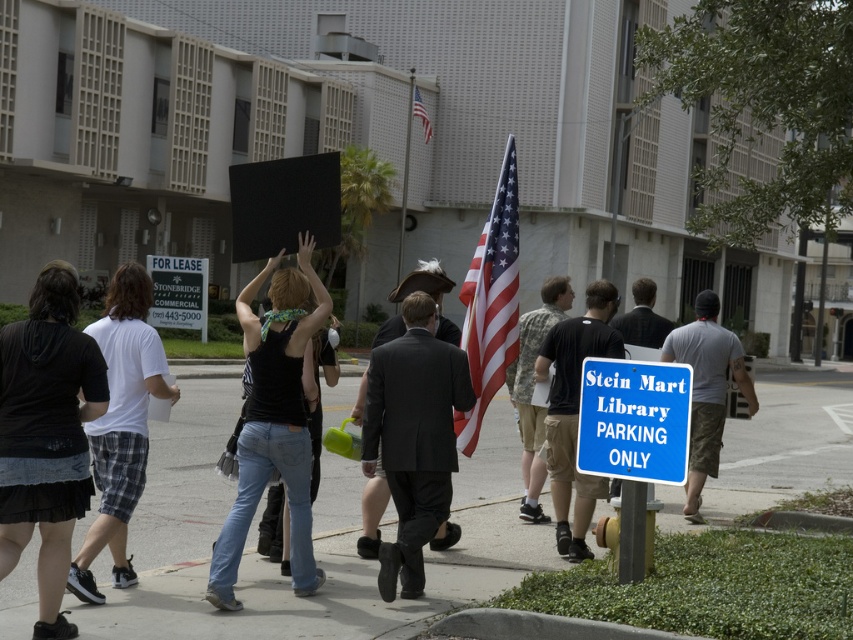
Who is higher up, dark gray suit at center or blue plastic sign at lower right?

blue plastic sign at lower right is above.

Does dark gray suit at center have a greater height compared to blue plastic sign at lower right?

Correct, dark gray suit at center is much taller as blue plastic sign at lower right.

Who is more distant from viewer, (389, 556) or (582, 380)?

The point (389, 556) is behind.

Find the location of a particular element. The width and height of the screenshot is (853, 640). dark gray suit at center is located at coordinates (413, 436).

Is white plaid shorts at left bigger than blue plastic sign at lower right?

Indeed, white plaid shorts at left has a larger size compared to blue plastic sign at lower right.

Consider the image. Can you confirm if white plaid shorts at left is positioned below blue plastic sign at lower right?

Indeed, white plaid shorts at left is positioned under blue plastic sign at lower right.

What do you see at coordinates (120, 424) in the screenshot? I see `white plaid shorts at left` at bounding box center [120, 424].

Where is `white plaid shorts at left`? The width and height of the screenshot is (853, 640). white plaid shorts at left is located at coordinates (120, 424).

Between concrete sidewalk at center and gray cotton t-shirt at center-right, which one is positioned higher?

gray cotton t-shirt at center-right

Which is below, concrete sidewalk at center or gray cotton t-shirt at center-right?

concrete sidewalk at center

Who is more distant from viewer, (213, 488) or (708, 419)?

Point (213, 488)

Find the location of a particular element. The image size is (853, 640). concrete sidewalk at center is located at coordinates (312, 540).